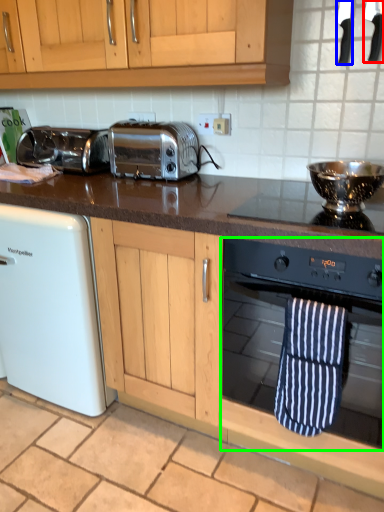
Question: Estimate the real-world distances between objects in this image. Which object is farther from appliance (highlighted by a red box), appliance (highlighted by a blue box) or oven (highlighted by a green box)?

Choices:
 (A) appliance
 (B) oven

Answer: (B)